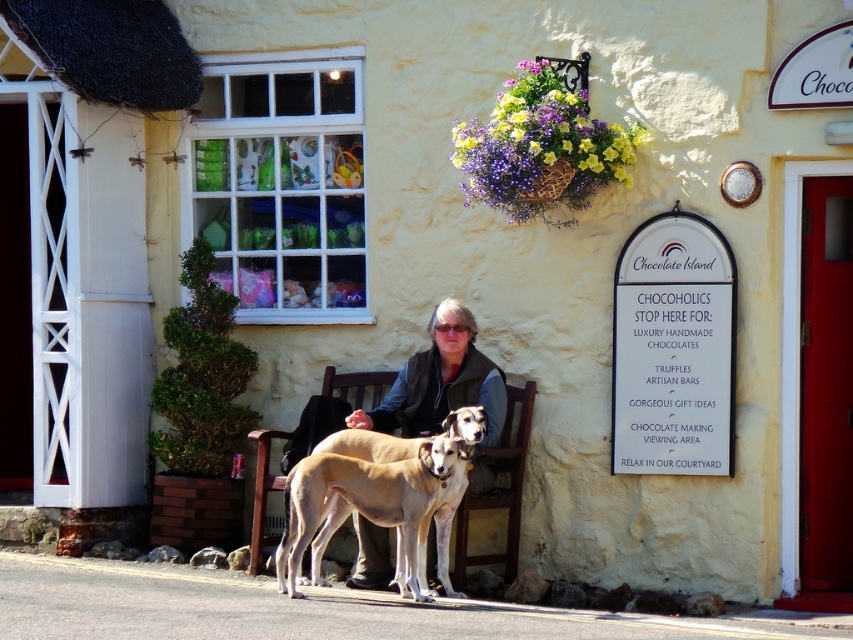
Question: Which point is closer to the camera?

Choices:
 (A) brown wooden bench at center
 (B) matte black jacket at center

Answer: (A)

Question: Observing the image, what is the correct spatial positioning of matte black jacket at center in reference to light brown fur at center?

Choices:
 (A) above
 (B) below

Answer: (A)

Question: Which object is closer to the camera taking this photo?

Choices:
 (A) matte black jacket at center
 (B) light brown fur at center
 (C) brown wooden bench at center

Answer: (B)

Question: Does matte black jacket at center have a lesser width compared to light brown fur at center?

Choices:
 (A) no
 (B) yes

Answer: (B)

Question: Among these objects, which one is farthest from the camera?

Choices:
 (A) matte black jacket at center
 (B) light brown fur at center
 (C) brown wooden bench at center

Answer: (A)

Question: Is matte black jacket at center thinner than brown wooden bench at center?

Choices:
 (A) yes
 (B) no

Answer: (B)